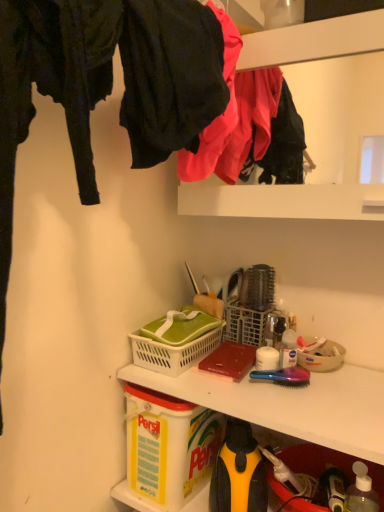
Measure the distance between point (168,336) and camera.

38.82 inches.

The width and height of the screenshot is (384, 512). In order to click on white plastic picnic basket at center in this screenshot , I will do `click(176, 341)`.

What do you see at coordinates (169, 76) in the screenshot? I see `matte black pants at upper left, which is the first clothing in front-to-back order` at bounding box center [169, 76].

At what (x,y) coordinates should I click in order to perform the action: click on matte black pants at upper left, which ranks as the second clothing in back-to-front order. Please return your answer as a coordinate pair (x, y). This screenshot has height=512, width=384. Looking at the image, I should click on (169, 76).

What do you see at coordinates (278, 201) in the screenshot?
I see `matte plastic clothes at upper center` at bounding box center [278, 201].

Where is `white plastic picnic basket at center`? Image resolution: width=384 pixels, height=512 pixels. white plastic picnic basket at center is located at coordinates (176, 341).

Does matte plastic clothes at upper center turn towards beige plastic bowl at center right?

No, matte plastic clothes at upper center does not turn towards beige plastic bowl at center right.

From the image's perspective, is matte plastic clothes at upper center on beige plastic bowl at center right?

Correct, matte plastic clothes at upper center appears higher than beige plastic bowl at center right in the image.

The width and height of the screenshot is (384, 512). I want to click on shelf in front of the beige plastic bowl at center right, so click(x=278, y=201).

Could beige plastic bowl at center right be considered to be inside matte plastic clothes at upper center?

No.

Can matte pink fabric at upper center, acting as the 1th clothing starting from the back, be found inside white plastic bottle at center, the 2th bottle positioned from the front?

No.

From a real-world perspective, is white plastic bottle at center, the 2th bottle in the right-to-left sequence, positioned above or below matte pink fabric at upper center, the 2th clothing in the front-to-back sequence?

In terms of real-world spatial position, white plastic bottle at center, the 2th bottle in the right-to-left sequence, is below matte pink fabric at upper center, the 2th clothing in the front-to-back sequence.

Which object is positioned more to the right, white plastic bottle at center, the 2th bottle in the right-to-left sequence, or matte pink fabric at upper center, the 2th clothing in the front-to-back sequence?

Positioned to the right is white plastic bottle at center, the 2th bottle in the right-to-left sequence.

Is transparent plastic bottle at lower right, the second bottle from the back, facing away from white plastic bottle at center, the 1th bottle viewed from the top?

No, transparent plastic bottle at lower right, the second bottle from the back,'s orientation is not away from white plastic bottle at center, the 1th bottle viewed from the top.

Which of these two, transparent plastic bottle at lower right, the first bottle in the bottom-to-top sequence, or white plastic bottle at center, the 1th bottle viewed from the top, is thinner?

white plastic bottle at center, the 1th bottle viewed from the top.

Measure the distance from transparent plastic bottle at lower right, which is counted as the 1th bottle, starting from the right, to white plastic bottle at center, the 2th bottle in the right-to-left sequence.

10.95 inches.

Is transparent plastic bottle at lower right, which appears as the second bottle when viewed from the left, positioned beyond the bounds of white plastic bottle at center, the 1th bottle viewed from the top?

Yes.

From the image's perspective, is matte pink fabric at upper center, the 2th clothing in the front-to-back sequence, below white plastic picnic basket at center?

No.

Which of these two, matte pink fabric at upper center, acting as the 1th clothing starting from the back, or white plastic picnic basket at center, is bigger?

matte pink fabric at upper center, acting as the 1th clothing starting from the back, is bigger.

Which object is more forward, matte pink fabric at upper center, acting as the 1th clothing starting from the back, or white plastic picnic basket at center?

matte pink fabric at upper center, acting as the 1th clothing starting from the back, is in front.

Is point (209, 159) more distant than point (172, 356)?

No, (209, 159) is in front of (172, 356).

Which is behind, point (142, 335) or point (174, 480)?

The point (142, 335) is farther from the camera.

Does white plastic picnic basket at center touch yellow plastic container at lower left?

No, white plastic picnic basket at center is not in contact with yellow plastic container at lower left.

Is the depth of white plastic picnic basket at center greater than that of yellow plastic container at lower left?

Yes, white plastic picnic basket at center is further from the viewer.

Considering the sizes of beige plastic bowl at center right and yellow plastic container at lower left in the image, is beige plastic bowl at center right wider or thinner than yellow plastic container at lower left?

beige plastic bowl at center right is thinner than yellow plastic container at lower left.

Between beige plastic bowl at center right and yellow plastic container at lower left, which one appears on the right side from the viewer's perspective?

beige plastic bowl at center right.

Locate an element on the screen. bowl that appears above the yellow plastic container at lower left (from the image's perspective) is located at coordinates (322, 357).

From the image's perspective, is white plastic bottle at center, the 1th bottle from the back, positioned above or below matte plastic clothes at upper center?

white plastic bottle at center, the 1th bottle from the back, is situated lower than matte plastic clothes at upper center in the image.

Is white plastic bottle at center, the 2th bottle positioned from the front, further to camera compared to matte plastic clothes at upper center?

Yes, white plastic bottle at center, the 2th bottle positioned from the front, is further from the camera.

How many degrees apart are the facing directions of white plastic bottle at center, the 2th bottle positioned from the front, and matte plastic clothes at upper center?

34.5 degrees.

Are white plastic bottle at center, the 1th bottle viewed from the top, and matte plastic clothes at upper center making contact?

No, white plastic bottle at center, the 1th bottle viewed from the top, is not making contact with matte plastic clothes at upper center.

Locate an element on the screen. This screenshot has height=512, width=384. shelf that is above the beige plastic bowl at center right (from a real-world perspective) is located at coordinates (278, 201).

The image size is (384, 512). There is a matte pink fabric at upper center, the 2th clothing in the front-to-back sequence. Find the location of `the 1st bottle below it (from the image's perspective)`. the 1st bottle below it (from the image's perspective) is located at coordinates (288, 349).

When comparing their distances from white plastic bottle at center, which is the second bottle in bottom-to-top order, does matte plastic clothes at upper center or matte pink fabric at upper center, acting as the 1th clothing starting from the back, seem closer?

matte plastic clothes at upper center lies closer to white plastic bottle at center, which is the second bottle in bottom-to-top order, than the other object.

Looking at this image, estimate the real-world distances between objects in this image. Which object is further from matte black pants at upper left, which ranks as the second clothing in back-to-front order, beige plastic bowl at center right or matte pink fabric at upper center, the 2th clothing in the front-to-back sequence?

beige plastic bowl at center right.

Based on their spatial positions, is white plastic bottle at center, acting as the 1th bottle starting from the left, or white plastic picnic basket at center closer to matte plastic clothes at upper center?

white plastic picnic basket at center lies closer to matte plastic clothes at upper center than the other object.

Estimate the real-world distances between objects in this image. Which object is further from matte pink fabric at upper center, the 2th clothing in the front-to-back sequence, transparent plastic bottle at lower right, which is counted as the 1th bottle, starting from the right, or white plastic bottle at center, the 1th bottle viewed from the top?

Among the two, transparent plastic bottle at lower right, which is counted as the 1th bottle, starting from the right, is located further to matte pink fabric at upper center, the 2th clothing in the front-to-back sequence.

When comparing their distances from beige plastic bowl at center right, does transparent plastic bottle at lower right, which appears as the second bottle when viewed from the left, or white plastic bottle at center, the 1th bottle from the back, seem closer?

Among the two, white plastic bottle at center, the 1th bottle from the back, is located nearer to beige plastic bowl at center right.

From the picture: When comparing their distances from white plastic bottle at center, which is the second bottle in bottom-to-top order, does matte plastic clothes at upper center or matte black pants at upper left, which is the first clothing in front-to-back order, seem further?

Based on the image, matte black pants at upper left, which is the first clothing in front-to-back order, appears to be further to white plastic bottle at center, which is the second bottle in bottom-to-top order.

Based on their spatial positions, is white plastic bottle at center, the 2th bottle positioned from the front, or matte black pants at upper left, which is the first clothing in front-to-back order, closer to beige plastic bowl at center right?

The object closer to beige plastic bowl at center right is white plastic bottle at center, the 2th bottle positioned from the front.

When comparing their distances from yellow plastic container at lower left, does matte pink fabric at upper center, the 2th clothing in the front-to-back sequence, or matte plastic clothes at upper center seem further?

matte pink fabric at upper center, the 2th clothing in the front-to-back sequence, lies further to yellow plastic container at lower left than the other object.

At what (x,y) coordinates should I click in order to perform the action: click on bottle between matte plastic clothes at upper center and beige plastic bowl at center right vertically. Please return your answer as a coordinate pair (x, y). This screenshot has height=512, width=384. Looking at the image, I should click on (288, 349).

At what (x,y) coordinates should I click in order to perform the action: click on bottle that lies between matte black pants at upper left, which is the first clothing in front-to-back order, and beige plastic bowl at center right from top to bottom. Please return your answer as a coordinate pair (x, y). The image size is (384, 512). Looking at the image, I should click on (288, 349).

This screenshot has height=512, width=384. Find the location of `bowl that lies between matte black pants at upper left, which ranks as the second clothing in back-to-front order, and yellow plastic container at lower left from top to bottom`. bowl that lies between matte black pants at upper left, which ranks as the second clothing in back-to-front order, and yellow plastic container at lower left from top to bottom is located at coordinates (322, 357).

Where is `picnic basket that lies between matte black pants at upper left, which is the first clothing in front-to-back order, and beige plastic bowl at center right from top to bottom`? This screenshot has width=384, height=512. picnic basket that lies between matte black pants at upper left, which is the first clothing in front-to-back order, and beige plastic bowl at center right from top to bottom is located at coordinates (176, 341).